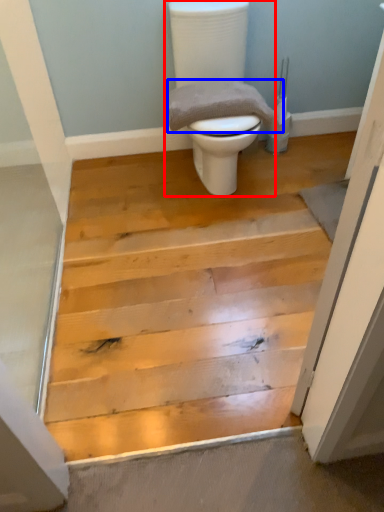
Question: Which of the following is the closest to the observer, toilet (highlighted by a red box) or material (highlighted by a blue box)?

Choices:
 (A) toilet
 (B) material

Answer: (A)